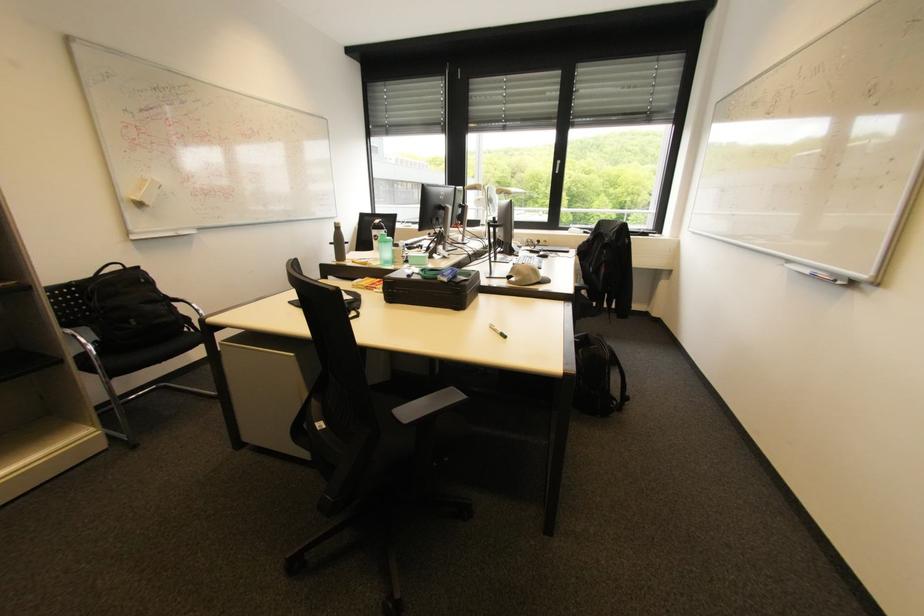
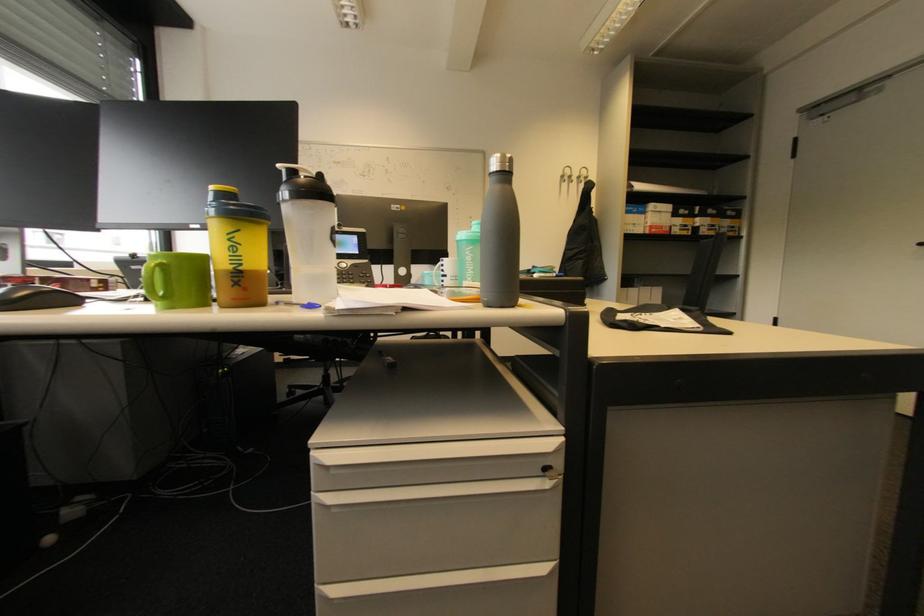
Question: I am providing you with two images of the same scene from different viewpoints. Please identify which objects are invisible in image2.

Choices:
 (A) cardboard file handle
 (B) green whiteboard marker
 (C) cabinet drawer handle
 (D) yellow shaker bottle

Answer: (B)